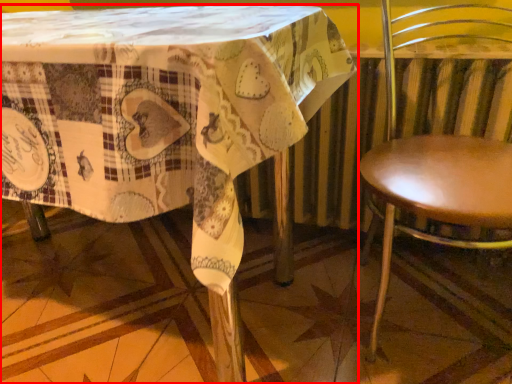
Question: From the image's perspective, what is the correct spatial positioning of table (annotated by the red box) in reference to chair?

Choices:
 (A) above
 (B) below

Answer: (A)